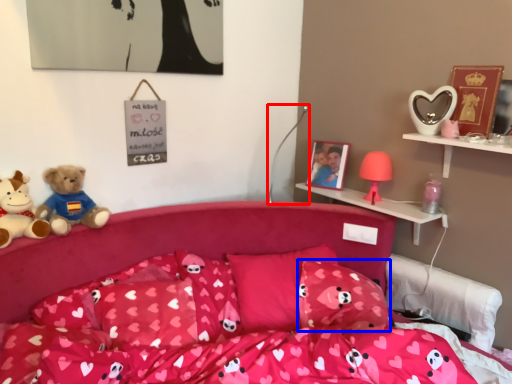
Question: Which object is further to the camera taking this photo, lamp (highlighted by a red box) or pillow (highlighted by a blue box)?

Choices:
 (A) lamp
 (B) pillow

Answer: (A)